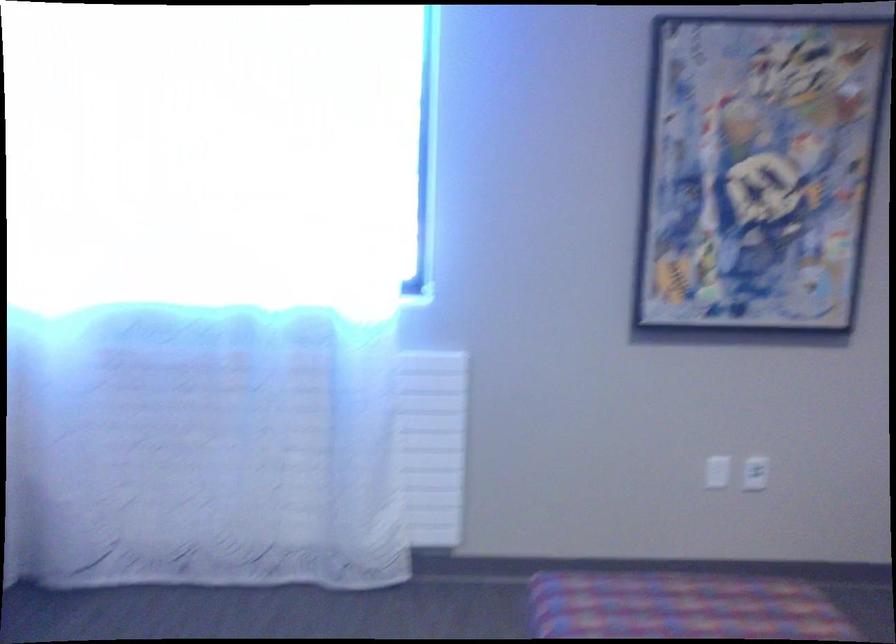
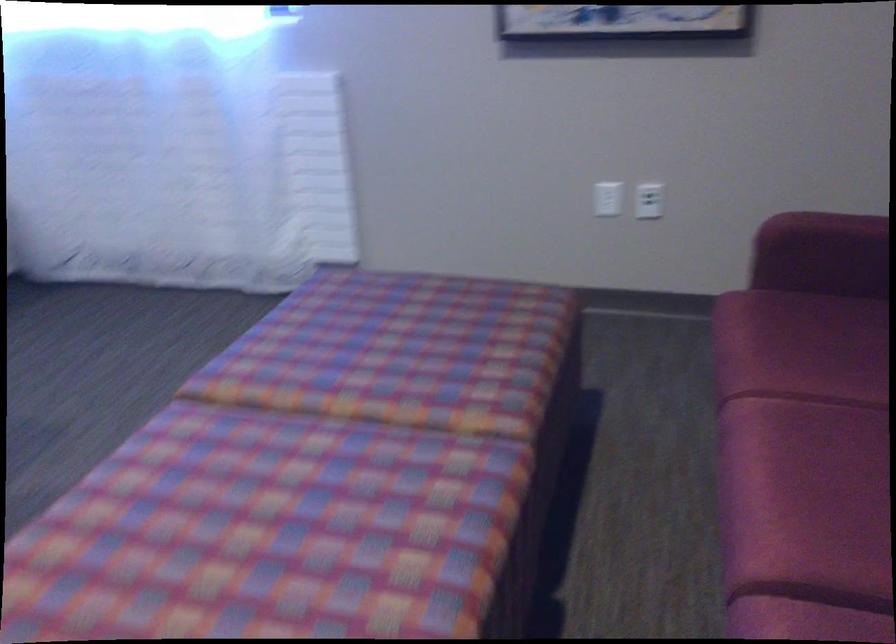
Question: The images are taken continuously from a first-person perspective. In which direction are you moving?

Choices:
 (A) Left
 (B) Right
 (C) Forward
 (D) Backward

Answer: (B)